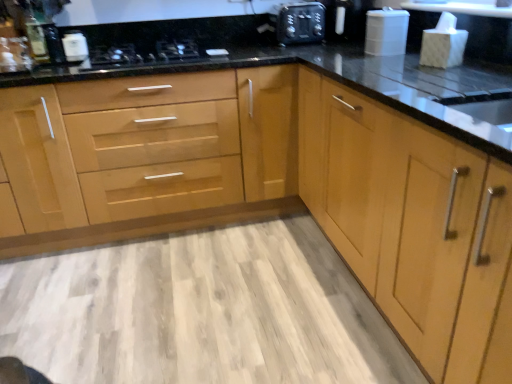
Question: Can you confirm if white glossy container at upper left, arranged as the 1th appliance when viewed from the left, is shorter than light wood cabinet at center, arranged as the first cabinetry when viewed from the left?

Choices:
 (A) yes
 (B) no

Answer: (A)

Question: Is white glossy container at upper left, arranged as the second appliance when viewed from the right, outside light wood cabinet at center, which ranks as the second cabinetry in right-to-left order?

Choices:
 (A) no
 (B) yes

Answer: (A)

Question: Considering the relative sizes of white glossy container at upper left, arranged as the 1th appliance when viewed from the left, and light wood cabinet at center, arranged as the first cabinetry when viewed from the left, in the image provided, is white glossy container at upper left, arranged as the 1th appliance when viewed from the left, bigger than light wood cabinet at center, arranged as the first cabinetry when viewed from the left,?

Choices:
 (A) no
 (B) yes

Answer: (A)

Question: Is white glossy container at upper left, arranged as the second appliance when viewed from the right, far from light wood cabinet at center, which ranks as the second cabinetry in right-to-left order?

Choices:
 (A) yes
 (B) no

Answer: (B)

Question: Is white glossy container at upper left, arranged as the 1th appliance when viewed from the left, closer to camera compared to light wood cabinet at center, which ranks as the second cabinetry in right-to-left order?

Choices:
 (A) yes
 (B) no

Answer: (B)

Question: Does white glossy container at upper left, arranged as the 1th appliance when viewed from the left, turn towards light wood cabinet at center, arranged as the first cabinetry when viewed from the left?

Choices:
 (A) no
 (B) yes

Answer: (B)

Question: Is matte black sink at right far away from white glossy container at upper left, arranged as the second appliance when viewed from the right?

Choices:
 (A) yes
 (B) no

Answer: (A)

Question: From a real-world perspective, does matte black sink at right sit lower than white glossy container at upper left, arranged as the 1th appliance when viewed from the left?

Choices:
 (A) no
 (B) yes

Answer: (B)

Question: Is matte black sink at right bigger than white glossy container at upper left, arranged as the 1th appliance when viewed from the left?

Choices:
 (A) yes
 (B) no

Answer: (A)

Question: From the image's perspective, does matte black sink at right appear lower than white glossy container at upper left, arranged as the 1th appliance when viewed from the left?

Choices:
 (A) yes
 (B) no

Answer: (A)

Question: Considering the relative positions of matte black sink at right and white glossy container at upper left, arranged as the 1th appliance when viewed from the left, in the image provided, is matte black sink at right in front of white glossy container at upper left, arranged as the 1th appliance when viewed from the left,?

Choices:
 (A) yes
 (B) no

Answer: (A)

Question: Considering the relative sizes of matte black sink at right and white glossy container at upper left, arranged as the 1th appliance when viewed from the left, in the image provided, is matte black sink at right shorter than white glossy container at upper left, arranged as the 1th appliance when viewed from the left,?

Choices:
 (A) yes
 (B) no

Answer: (B)

Question: From the image's perspective, is matte silver faucet at upper left below matte black sink at right?

Choices:
 (A) no
 (B) yes

Answer: (A)